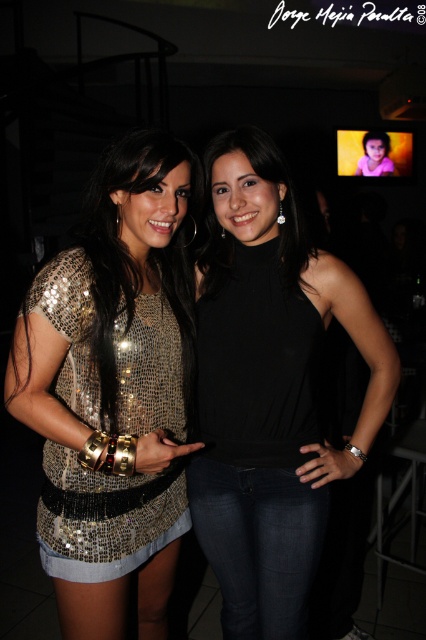
Question: Among these points, which one is nearest to the camera?

Choices:
 (A) (158, 403)
 (B) (131, 180)
 (C) (239, 499)

Answer: (B)

Question: Which of the following is the farthest from the observer?

Choices:
 (A) black matte tank top at center
 (B) sequined gold dress at center
 (C) sequined metallic dress at left

Answer: (A)

Question: Which object is positioned farthest from the black matte tank top at center?

Choices:
 (A) sequined metallic dress at left
 (B) sequined gold dress at center

Answer: (A)

Question: Does black matte tank top at center have a smaller size compared to sequined gold dress at center?

Choices:
 (A) yes
 (B) no

Answer: (B)

Question: Can you confirm if sequined metallic dress at left is positioned to the right of sequined gold dress at center?

Choices:
 (A) yes
 (B) no

Answer: (A)

Question: Can you confirm if black matte tank top at center is wider than sequined metallic dress at left?

Choices:
 (A) no
 (B) yes

Answer: (B)